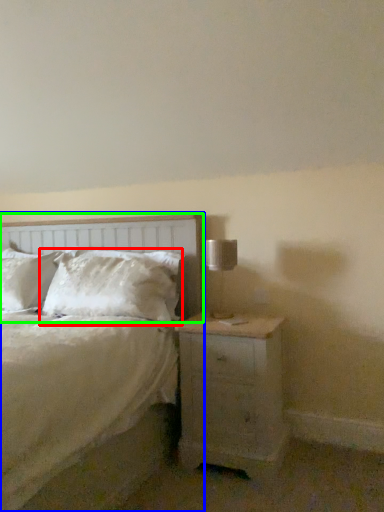
Question: Based on their relative distances, which object is nearer to pillow (highlighted by a red box)? Choose from bed (highlighted by a blue box) and headboard (highlighted by a green box).

Choices:
 (A) bed
 (B) headboard

Answer: (B)